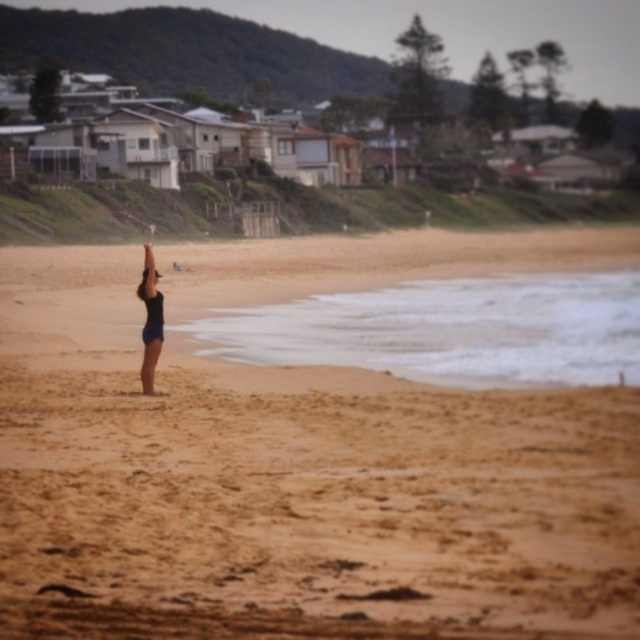
You are standing on the beach and want to place a small flag exactly where the brown sandy beach at center is located. According to the coordinates provided, where should you place the flag?

The brown sandy beach at center is located at coordinates point (291, 486), so you should place the flag there.

You are standing on the brown sandy beach at center and want to reach the black matte swimsuit at center. Which direction should you move to get closer to the swimsuit?

Since the brown sandy beach at center is closer to the viewer than the black matte swimsuit at center, you should move forward towards the swimsuit to get closer.

Looking at this image, you are standing on the beach and want to reach both the point at coordinates (164, 582) and the point at coordinates (156, 280). Which point should you reach first if you want to minimize your walking distance?

You should reach point (164, 582) first because it is closer to you than point (156, 280).